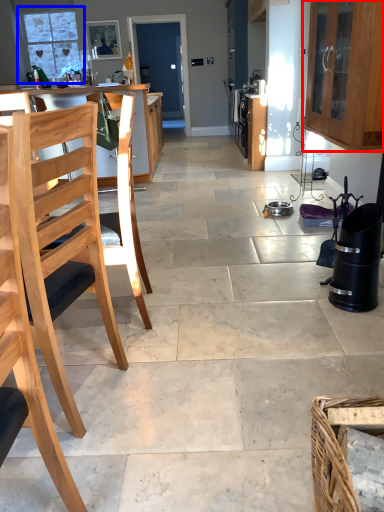
Question: Which object appears farthest to the camera in this image, cabinetry (highlighted by a red box) or window (highlighted by a blue box)?

Choices:
 (A) cabinetry
 (B) window

Answer: (B)